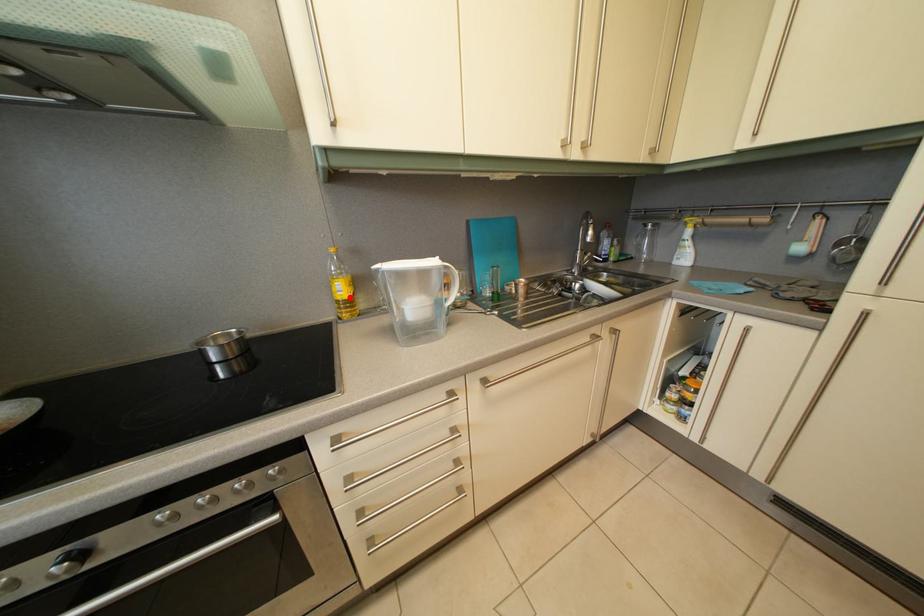
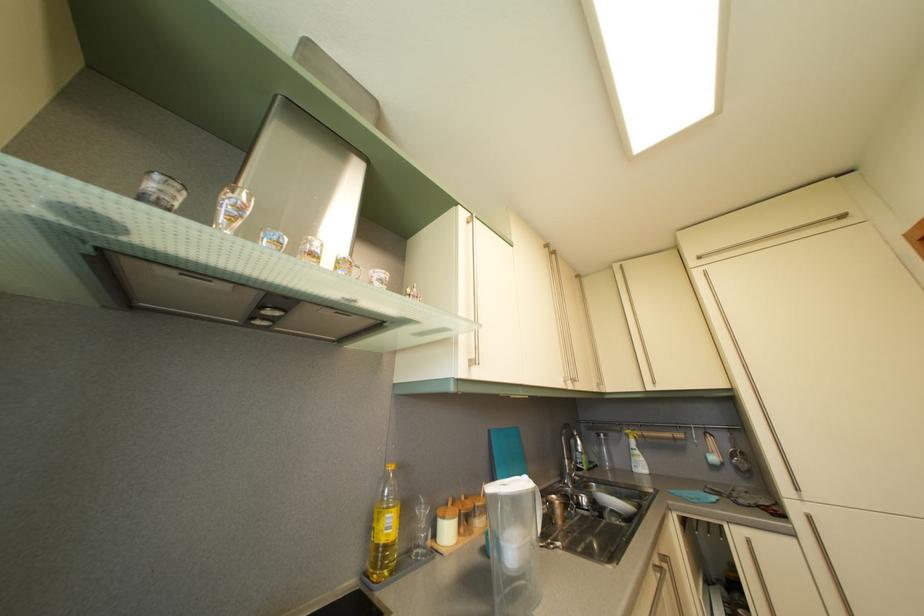
Find the pixel in the second image that matches the highlighted location in the first image.

(396, 533)